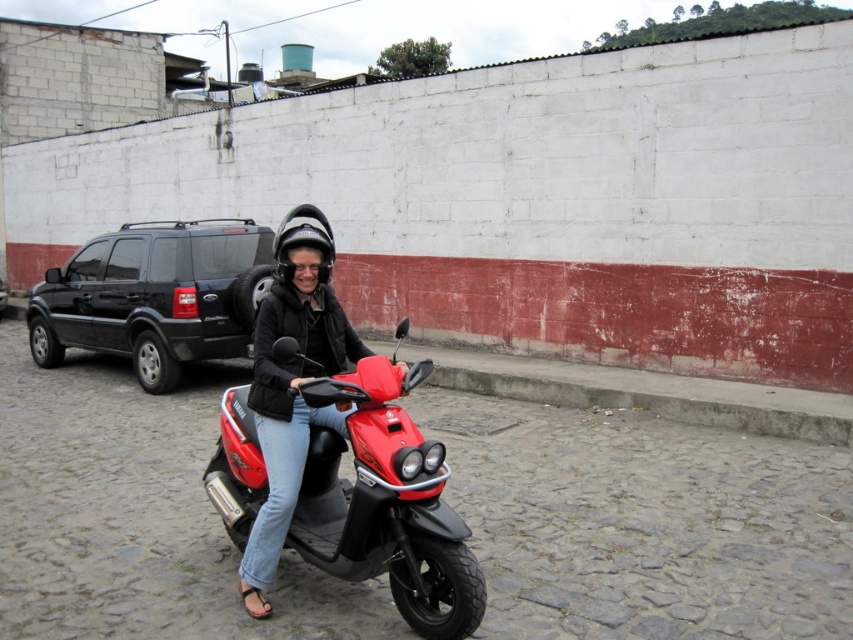
Question: Which object is closer to the camera taking this photo?

Choices:
 (A) matte black helmet at upper center
 (B) black matte suv at left
 (C) shiny red scooter at center

Answer: (C)

Question: Can you confirm if matte black helmet at upper center is positioned above black matte helmet at center?

Choices:
 (A) yes
 (B) no

Answer: (B)

Question: Which point appears farthest from the camera in this image?

Choices:
 (A) (277, 330)
 (B) (120, 310)

Answer: (B)

Question: Which object appears closest to the camera in this image?

Choices:
 (A) black matte helmet at center
 (B) black matte suv at left
 (C) shiny red scooter at center
 (D) matte black helmet at upper center

Answer: (C)

Question: Does shiny red scooter at center have a lesser width compared to matte black helmet at upper center?

Choices:
 (A) no
 (B) yes

Answer: (A)

Question: Where is shiny red scooter at center located in relation to matte black helmet at upper center in the image?

Choices:
 (A) left
 (B) right

Answer: (B)